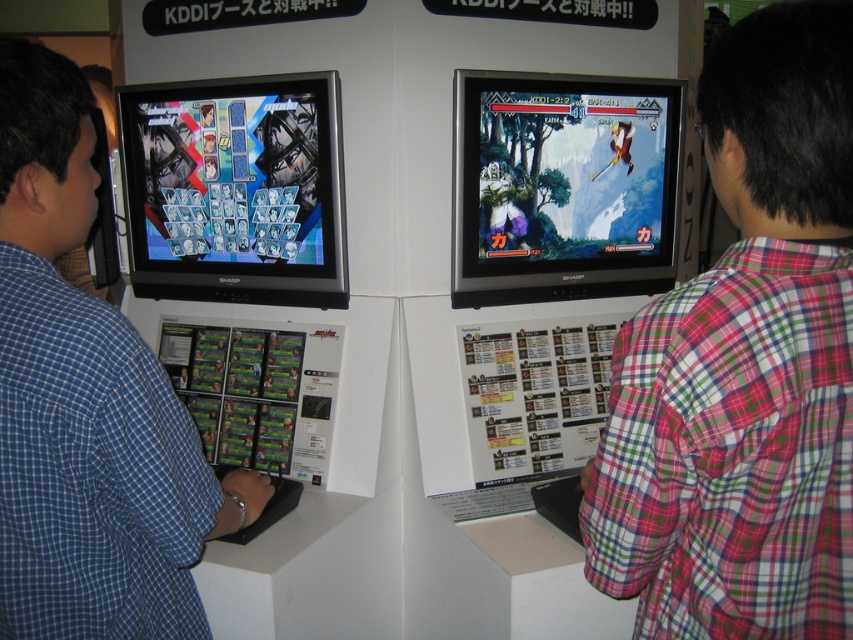
You are a game developer observing the two monitors. On the monitor with the plaid shirt at right and blue plaid shirt at left, which character has a taller in game representation?

The blue plaid shirt at left is taller than the plaid shirt at right, so the character with the blue plaid shirt at left has a taller in game representation.

You are a game developer observing two monitors at a gaming event. You notice the plaid shirt at right and the blue plaid shirt at left. Which shirt is covering more of the screen area on its respective monitor?

The plaid shirt at right is positioned over the blue plaid shirt at left, meaning it covers more screen area on its monitor.